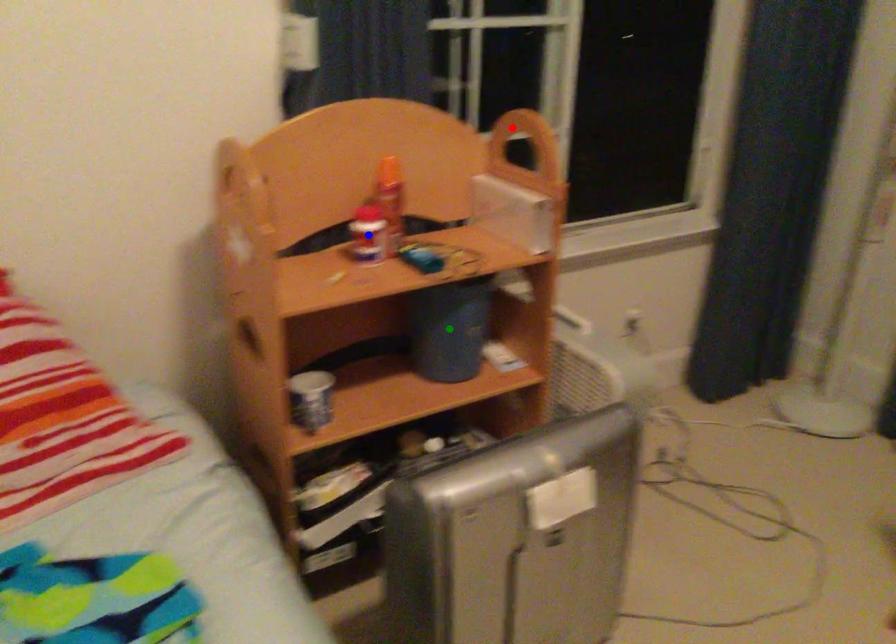
Order these from nearest to farthest:
1. green point
2. blue point
3. red point

green point
red point
blue point